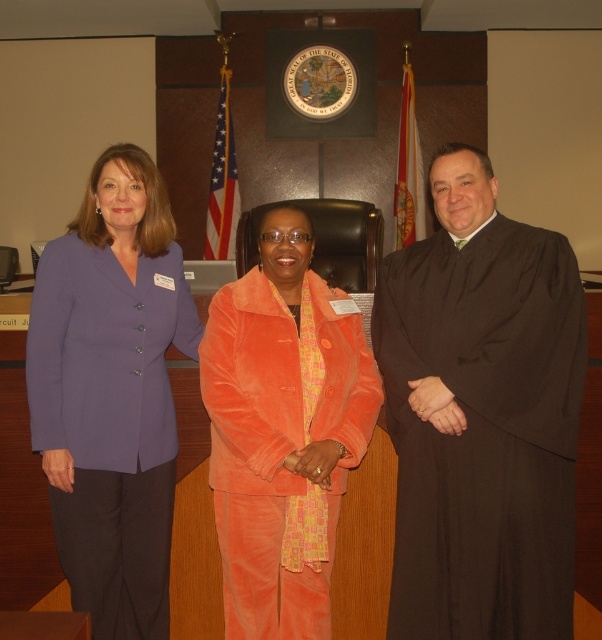
You are an artist who needs to paint the scene accurately. You notice the black matte robe at right and the velvet orange suit at center. Which one should you depict as shorter in your painting?

The black matte robe at right should be depicted as shorter because it is not as tall as the velvet orange suit at center.

You are a photographer standing at the back of the room. You need to take a closeup photo of the black matte robe at right without including the State of Florida seal in the background. Is the robe close enough for a clear shot?

The black matte robe at right is 2.01 meters away from the viewer. Since the robe is positioned away from the seal background, it can be captured clearly in a closeup without including the seal.